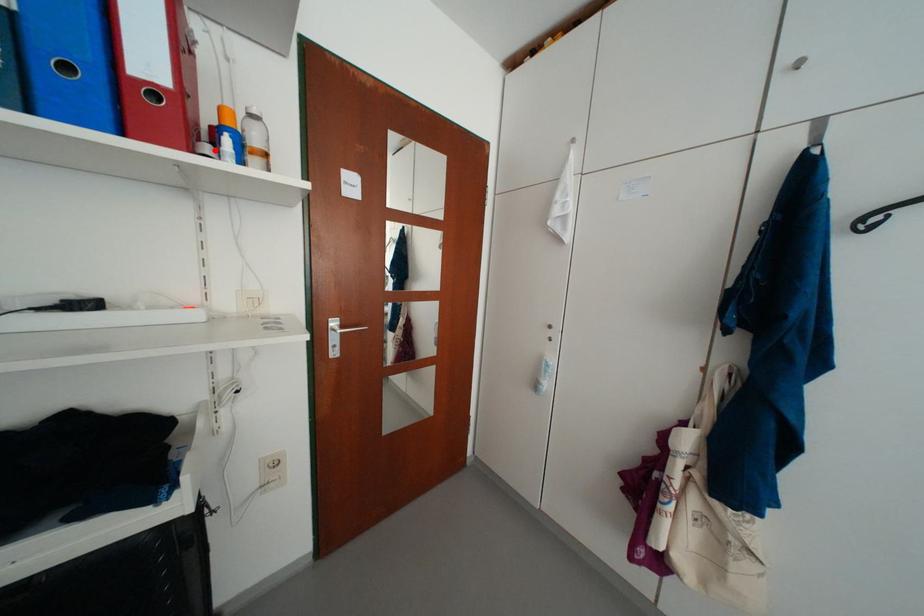
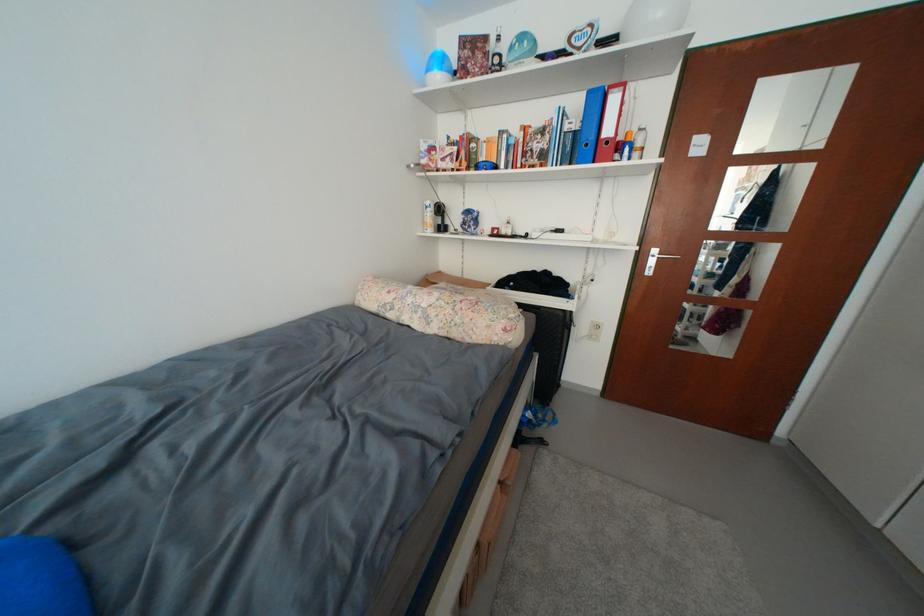
Locate, in the second image, the point that corresponds to the highlighted location in the first image.

(626, 159)